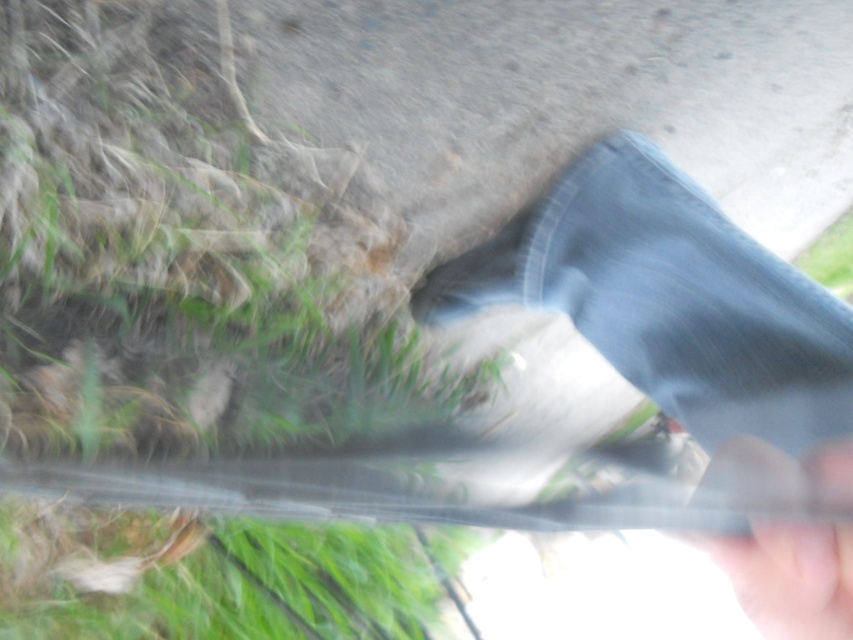
You are navigating a drone through the outdoor scene described. You need to fly from point A to point B. Point A is at coordinates point (706, 246) and point B is at point (436, 296). Given the terrain described, which direction should you fly to move from point A to point B?

To move from point A at coordinates point (706, 246) to point B at point (436, 296), you should fly towards the upper right direction since point B is located above and to the right of point A in the coordinate system.

You are a photographer trying to capture a detailed shot of the smooth skin hand at lower right and the matte black shoe at lower center. Given their sizes, which object should you zoom in on to ensure both are in focus without moving the camera?

The smooth skin hand at lower right has a lesser width compared to the matte black shoe at lower center, so you should zoom in on the smaller object, the smooth skin hand at lower right, to ensure both are in focus without moving the camera.

You are a delivery robot with a 10 inch wide base. You need to move from the green grass at lower left to the matte black shoe at lower center. Is there enough space for you to navigate between them?

The distance between the green grass at lower left and the matte black shoe at lower center is 12.07 inches. Since your base is 10 inches wide, there is sufficient space for you to navigate between them as the distance is greater than your width.